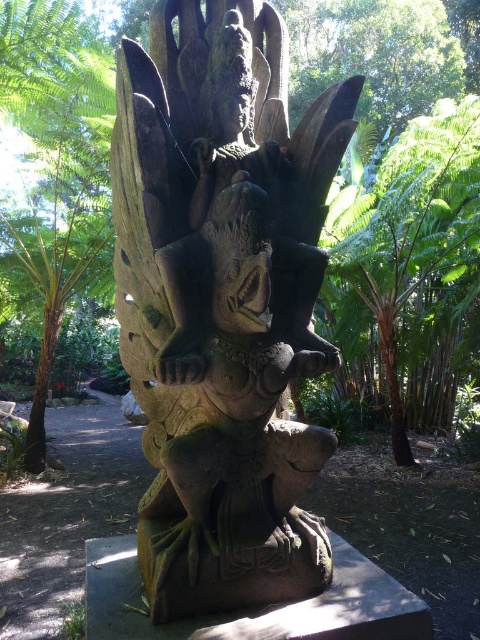
Does green leafy tree at left appear under brown rough tree trunk at right?

Actually, green leafy tree at left is above brown rough tree trunk at right.

Can you confirm if green leafy tree at left is positioned to the left of brown rough tree trunk at right?

Yes, green leafy tree at left is to the left of brown rough tree trunk at right.

Find the location of a particular element. The image size is (480, 640). green leafy tree at left is located at coordinates (56, 166).

Can you confirm if dark stone statue at center is positioned above green rough bark tree trunk at left?

Yes, dark stone statue at center is above green rough bark tree trunk at left.

Is point (182, 570) farther from camera compared to point (38, 394)?

No, (182, 570) is in front of (38, 394).

Find the location of a particular element. The width and height of the screenshot is (480, 640). dark stone statue at center is located at coordinates (223, 301).

Is green rough bark tree trunk at left to the left of brown rough tree trunk at right from the viewer's perspective?

Correct, you'll find green rough bark tree trunk at left to the left of brown rough tree trunk at right.

Find the location of `green rough bark tree trunk at left`. green rough bark tree trunk at left is located at coordinates (41, 388).

This screenshot has height=640, width=480. In order to click on green rough bark tree trunk at left in this screenshot , I will do `click(41, 388)`.